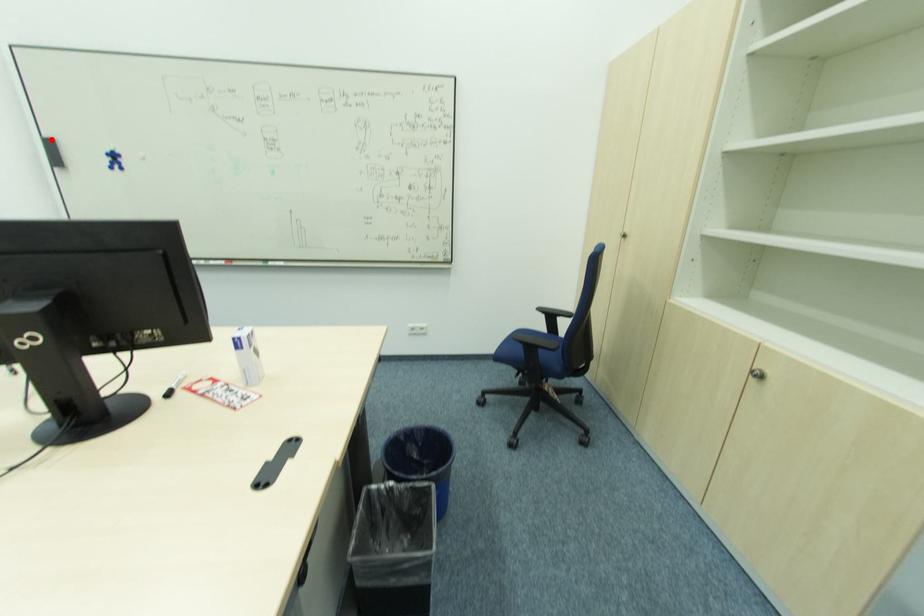
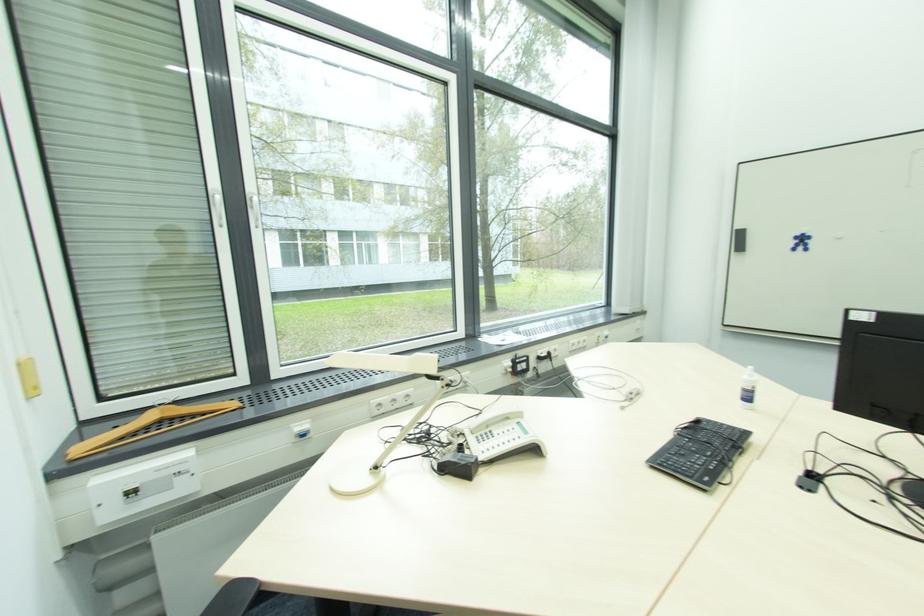
Find the pixel in the second image that matches the highlighted location in the first image.

(739, 230)